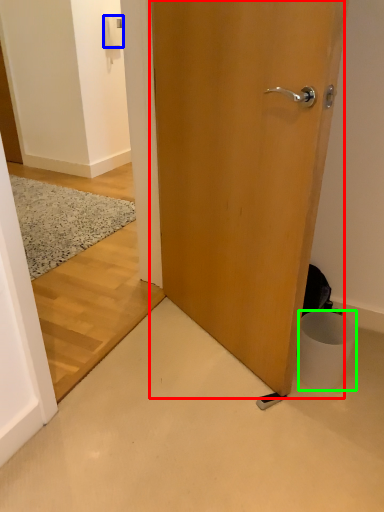
Question: Which object is the closest to the door (highlighted by a red box)? Choose among these: light switch (highlighted by a blue box) or trash bin/can (highlighted by a green box).

Choices:
 (A) light switch
 (B) trash bin/can

Answer: (B)